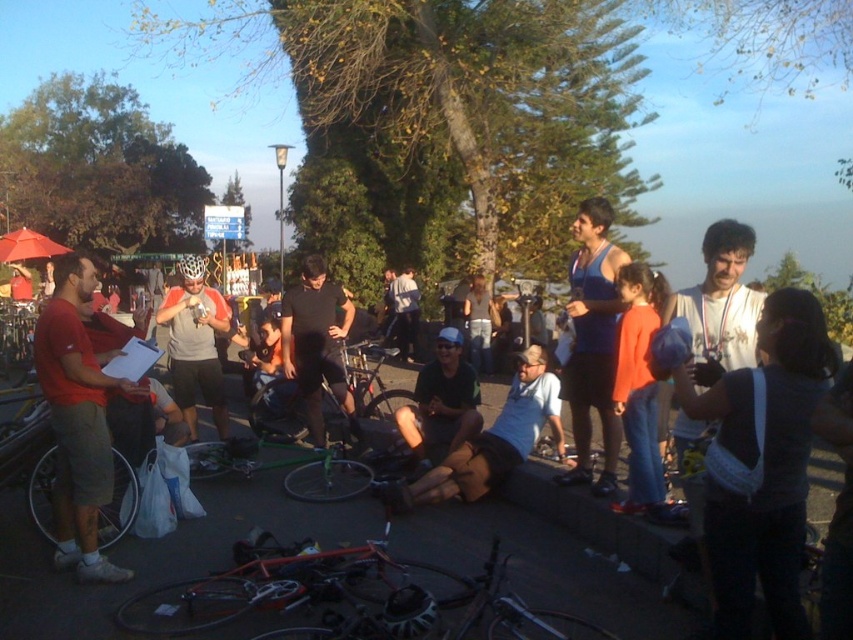
Looking at this image, is green metallic bicycle at center thinner than orange cotton shirt at center?

In fact, green metallic bicycle at center might be wider than orange cotton shirt at center.

Between green metallic bicycle at center and orange cotton shirt at center, which one appears on the right side from the viewer's perspective?

Positioned to the right is orange cotton shirt at center.

You are a GUI agent. You are given a task and a screenshot of the screen. Output one action in this format:
    pyautogui.click(x=<x>, y=<y>)
    Task: Click on the green metallic bicycle at center
    The image size is (853, 640).
    Given the screenshot: What is the action you would take?
    pyautogui.click(x=372, y=387)

You are a GUI agent. You are given a task and a screenshot of the screen. Output one action in this format:
    pyautogui.click(x=<x>, y=<y>)
    Task: Click on the green metallic bicycle at center
    The height and width of the screenshot is (640, 853).
    Given the screenshot: What is the action you would take?
    pyautogui.click(x=372, y=387)

Is matte gray helmet at center closer to camera compared to green fabric shorts at center?

No, matte gray helmet at center is behind green fabric shorts at center.

Who is shorter, matte gray helmet at center or green fabric shorts at center?

green fabric shorts at center

What do you see at coordinates (195, 342) in the screenshot?
I see `matte gray helmet at center` at bounding box center [195, 342].

I want to click on matte gray helmet at center, so click(x=195, y=342).

Between blue tank top at center and green metallic bicycle at center, which one appears on the right side from the viewer's perspective?

From the viewer's perspective, blue tank top at center appears more on the right side.

Who is taller, blue tank top at center or green metallic bicycle at center?

blue tank top at center

Is point (618, 449) farther from viewer compared to point (316, 499)?

No, (618, 449) is in front of (316, 499).

This screenshot has height=640, width=853. In order to click on blue tank top at center in this screenshot , I will do `click(592, 342)`.